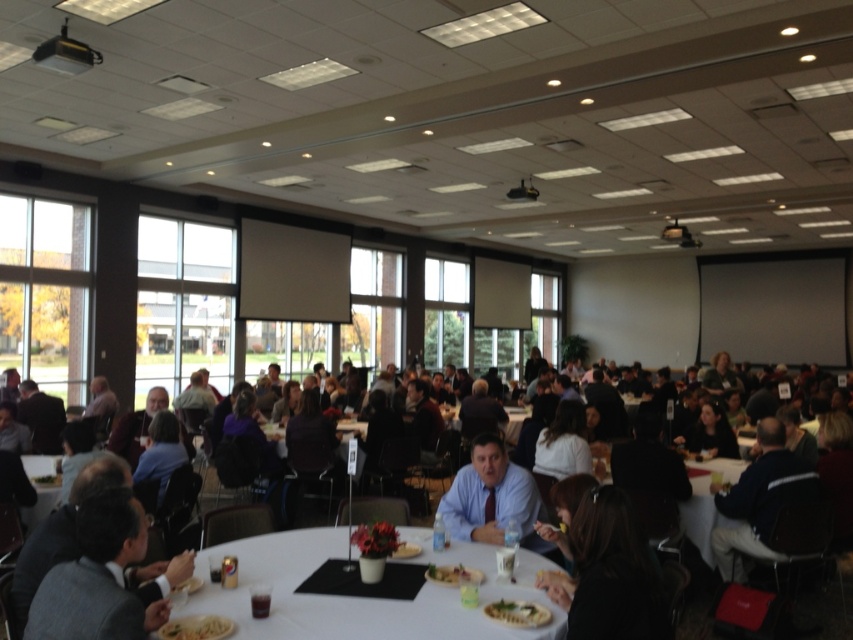
Who is positioned more to the right, dark brown hair at lower right or dark blue shirt at center?

dark blue shirt at center is more to the right.

Is dark brown hair at lower right above dark blue shirt at center?

Correct, dark brown hair at lower right is located above dark blue shirt at center.

Is point (656, 602) more distant than point (776, 513)?

No.

Find the location of a particular element. The width and height of the screenshot is (853, 640). dark brown hair at lower right is located at coordinates (604, 566).

Who is taller, gray suit at lower left or white plastic table at center?

white plastic table at center

Measure the distance from gray suit at lower left to white plastic table at center.

The distance of gray suit at lower left from white plastic table at center is 3.96 meters.

Does point (125, 589) come closer to viewer compared to point (738, 465)?

Yes, point (125, 589) is closer to viewer.

Find the location of `gray suit at lower left`. gray suit at lower left is located at coordinates (97, 577).

Is gray suit at lower left thinner than white plastic table at lower left?

Correct, gray suit at lower left's width is less than white plastic table at lower left's.

Is point (96, 499) positioned after point (47, 467)?

That is False.

Find the location of a particular element. gray suit at lower left is located at coordinates [x=97, y=577].